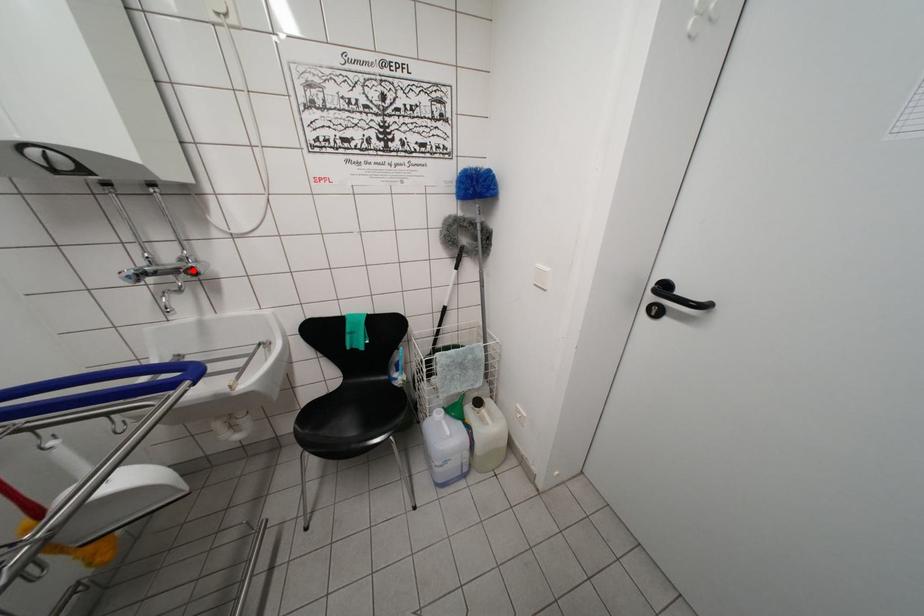
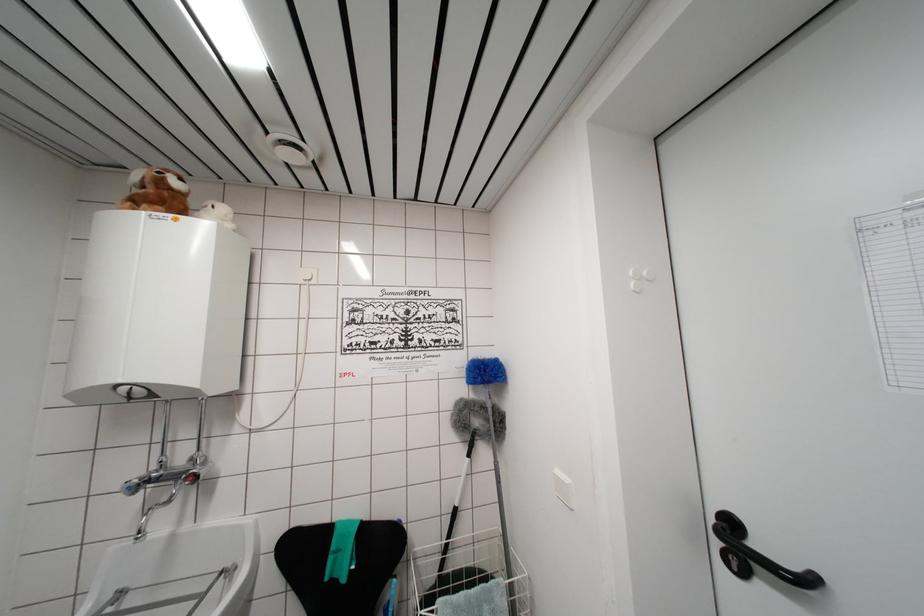
In the second image, find the point that corresponds to the highlighted location in the first image.

(197, 476)